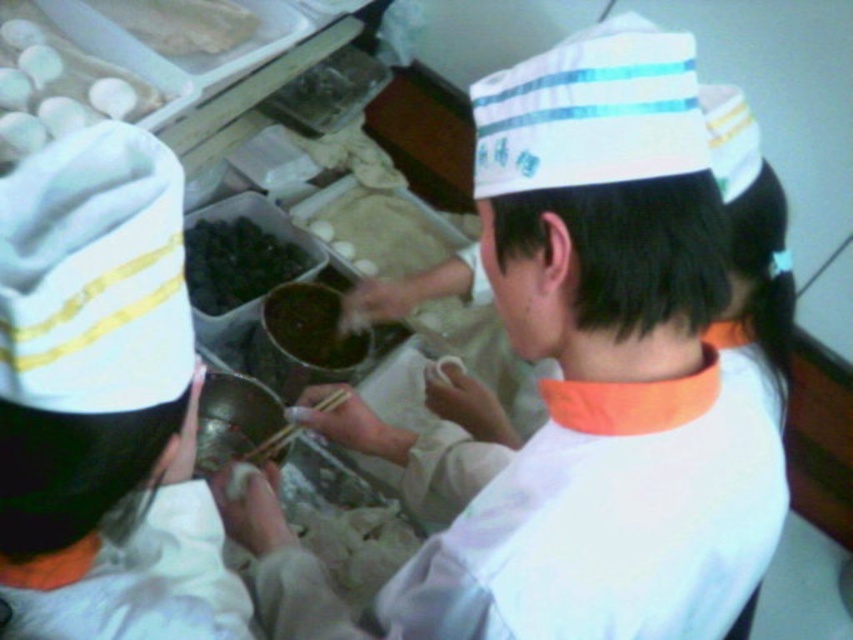
Question: Which point appears farthest from the camera in this image?

Choices:
 (A) (173, 36)
 (B) (578, 387)
 (C) (352, 259)

Answer: (C)

Question: Where is white fabric shirt at center located in relation to dark matte paste at center in the image?

Choices:
 (A) right
 (B) left

Answer: (A)

Question: Can you confirm if white matte eggs at upper left is smaller than black glossy food at center?

Choices:
 (A) yes
 (B) no

Answer: (B)

Question: Among these points, which one is nearest to the camera?

Choices:
 (A) (550, 577)
 (B) (339, 243)
 (C) (293, 294)

Answer: (A)

Question: Does white matte eggs at upper left have a lesser width compared to black glossy food at center?

Choices:
 (A) no
 (B) yes

Answer: (A)

Question: Which of the following is the closest to the observer?

Choices:
 (A) white fabric shirt at center
 (B) dark matte paste at center

Answer: (A)